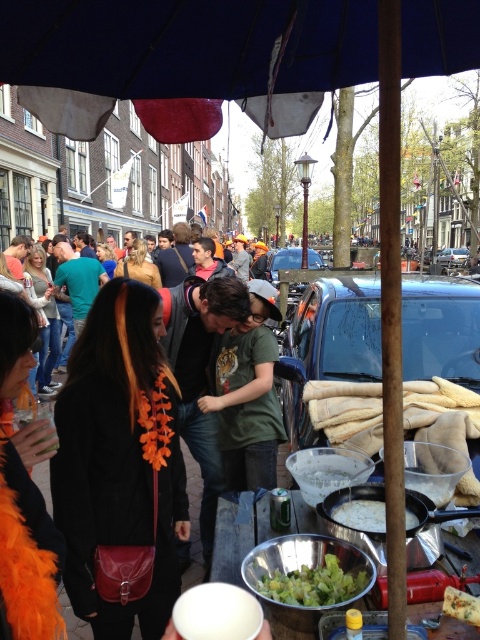
Question: Which object is the farthest from the green fabric bag at center?

Choices:
 (A) metallic blue car at center
 (B) white creamy soup at center

Answer: (A)

Question: Among these objects, which one is farthest from the camera?

Choices:
 (A) blue matte car at center
 (B) green leafy salad at lower center
 (C) green fabric bag at center

Answer: (A)

Question: Does blue matte car at center appear under green fabric bag at center?

Choices:
 (A) yes
 (B) no

Answer: (B)

Question: Does blue matte car at center appear on the left side of metallic blue car at center?

Choices:
 (A) no
 (B) yes

Answer: (B)

Question: Which point is closer to the camera?

Choices:
 (A) green fabric bag at center
 (B) metallic silver car at center

Answer: (A)

Question: Is blue matte car at center closer to the viewer compared to metallic blue car at center?

Choices:
 (A) no
 (B) yes

Answer: (B)